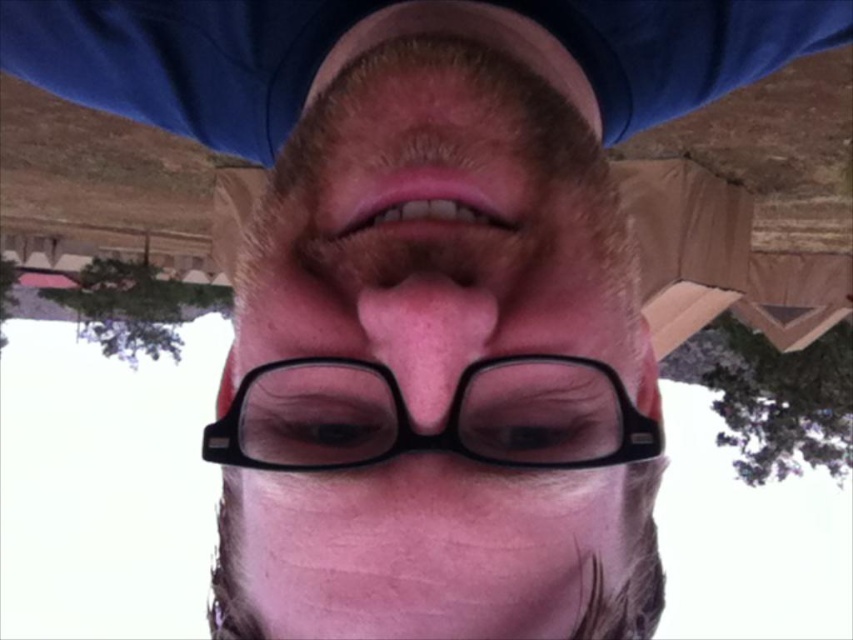
You are a photographer analyzing this selfie. You need to determine which object occupies more vertical space in the frame between the pink matte lips at center and the clear plastic eye at center. Based on the scene description, which one is taller?

The pink matte lips at center is much taller than the clear plastic eye at center, so the pink matte lips at center occupies more vertical space in the frame.

From the picture: You are a photographer adjusting the focus of your camera. You notice the pink matte lips at center and the clear plastic eye at center in the frame. Which object should you focus on first if you want to ensure the closest object is sharp?

The clear plastic eye at center is behind the pink matte lips at center, so you should focus on the pink matte lips at center first since it is closer to the camera.

You are a photographer adjusting the lighting for a portrait. You notice the black plastic glasses at center and the clear plastic eye at center in the frame. How far apart are these two items in centimeters?

The black plastic glasses at center and clear plastic eye at center are 3.21 centimeters apart from each other.